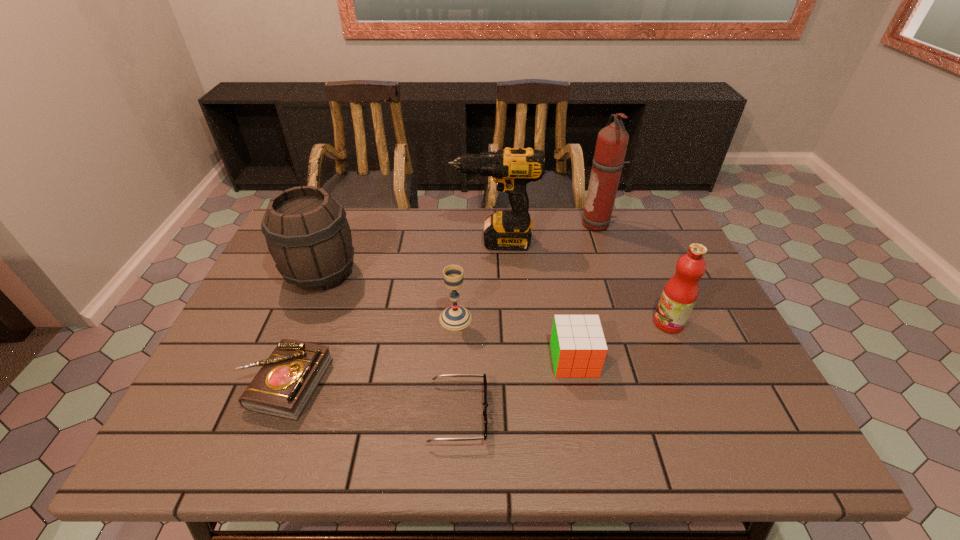
Where is `fire extinguisher`? fire extinguisher is located at coordinates (612, 141).

Find the location of a particular element. The height and width of the screenshot is (540, 960). the second object from right to left is located at coordinates (612, 141).

Where is `drill`? The image size is (960, 540). drill is located at coordinates (511, 168).

Find the location of a particular element. This screenshot has height=540, width=960. wine bucket is located at coordinates (307, 233).

Locate an element on the screen. The image size is (960, 540). fruit juice is located at coordinates (680, 293).

Locate an element on the screen. The height and width of the screenshot is (540, 960). chalice is located at coordinates (455, 317).

Find the location of a particular element. Image resolution: width=960 pixels, height=540 pixels. the third shortest object is located at coordinates (578, 347).

Find the location of a particular element. the seventh tallest object is located at coordinates (285, 383).

The width and height of the screenshot is (960, 540). I want to click on spectacles, so click(485, 403).

This screenshot has height=540, width=960. Find the location of `vacant space located on the side of the second object from right to left with the label and nozzle`. vacant space located on the side of the second object from right to left with the label and nozzle is located at coordinates (482, 225).